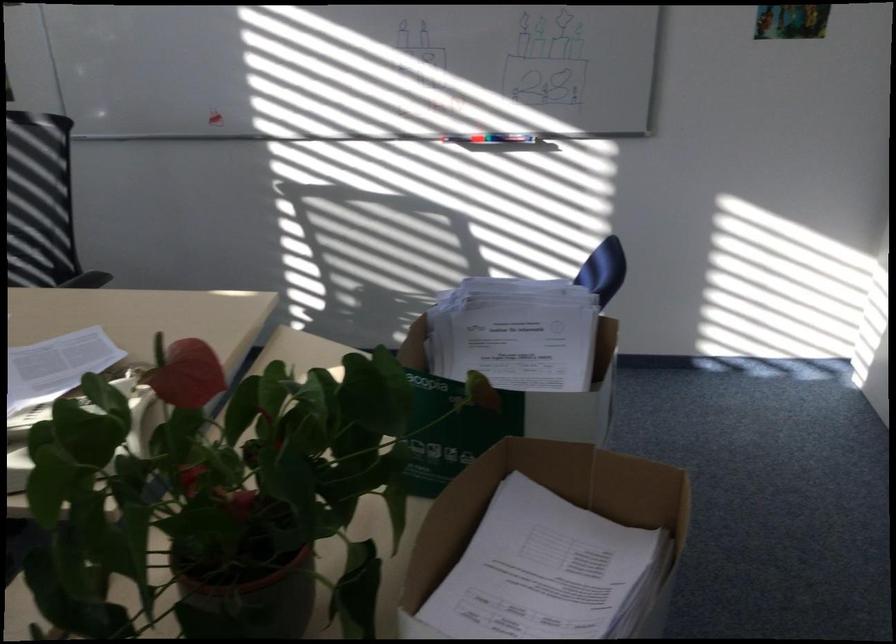
Find the location of a particular element. chair sitting surface is located at coordinates (39, 200).